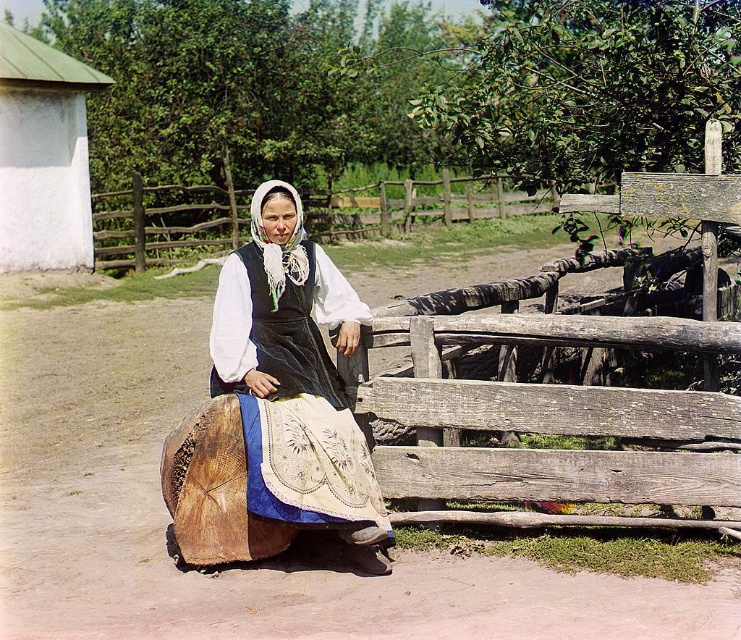
Question: Where is white lace headscarf at center located in relation to wooden at center in the image?

Choices:
 (A) right
 (B) left

Answer: (A)

Question: Is white lace headscarf at center closer to the viewer compared to wooden at center?

Choices:
 (A) no
 (B) yes

Answer: (B)

Question: Does white lace headscarf at center appear under wooden at center?

Choices:
 (A) yes
 (B) no

Answer: (A)

Question: Among these points, which one is farthest from the camera?

Choices:
 (A) (252, 365)
 (B) (142, 260)

Answer: (B)